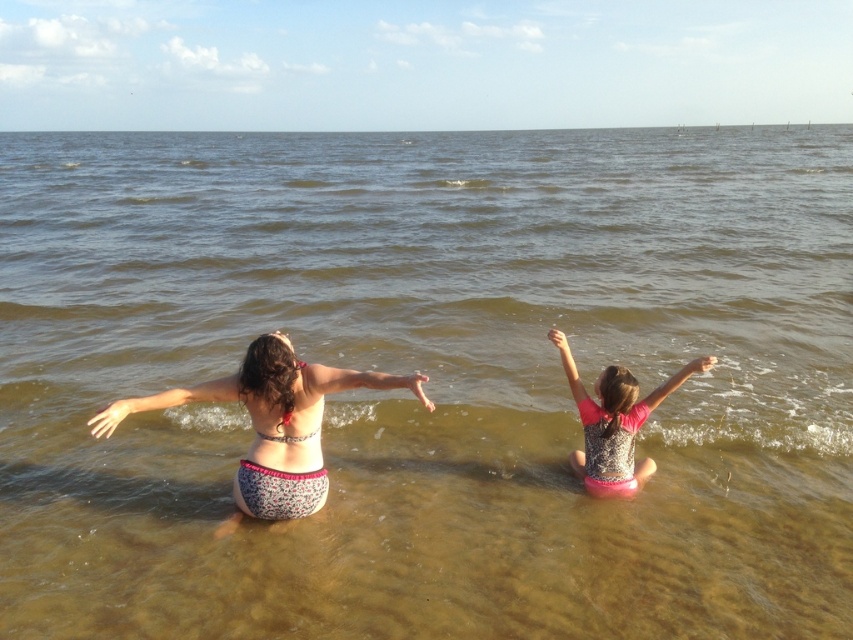
You are a photographer trying to capture a photo of both the floral fabric bikini bottom at center and the pink sequined swimsuit at center. Since you want to include both in the frame, which swimsuit should you position your camera closer to in order to ensure both are visible?

To capture both the floral fabric bikini bottom at center and the pink sequined swimsuit at center in the frame, position your camera closer to the pink sequined swimsuit at center because the floral fabric bikini bottom at center is located to the left of it, so centering the camera between them would ensure both are visible.

You are a photographer positioned at the camera. You want to take a photo of two points in the scene. The first point is at coordinate point(107, 413) and the second is at point(606, 488). Which point will appear larger in the photo?

Point(107, 413) will appear larger in the photo because it is closer to the viewer than point(606, 488).